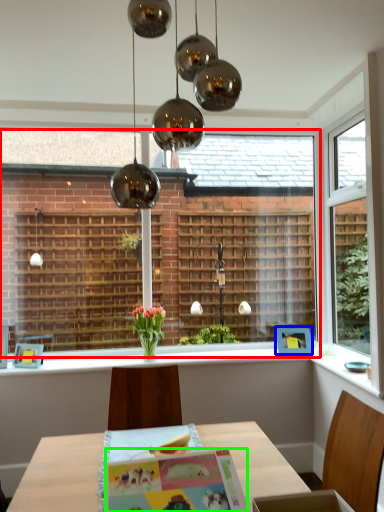
Question: Based on their relative distances, which object is farther from bay window (highlighted by a red box)? Choose from picture frame (highlighted by a blue box) and postcard (highlighted by a green box).

Choices:
 (A) picture frame
 (B) postcard

Answer: (B)